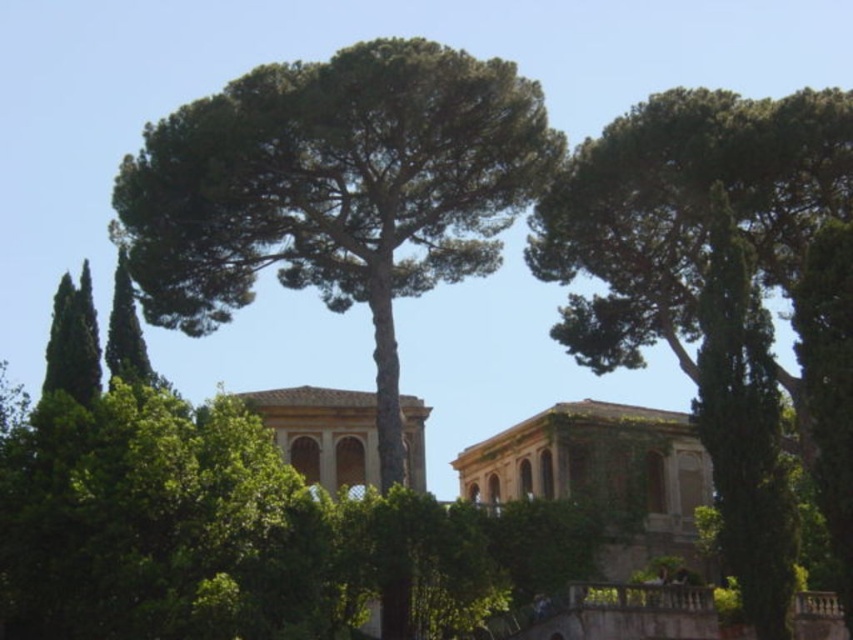
Question: Can you confirm if green leafy tree at center is positioned to the left of green leafy tree at upper center?

Choices:
 (A) no
 (B) yes

Answer: (B)

Question: Which point appears closest to the camera in this image?

Choices:
 (A) (345, 141)
 (B) (364, 426)

Answer: (A)

Question: Which of these objects is positioned farthest from the green leafy tree at center?

Choices:
 (A) brown stone palace at center
 (B) stone/brick palace at center
 (C) green leafy tree at upper center

Answer: (A)

Question: Is green leafy tree at center behind green leafy tree at upper center?

Choices:
 (A) no
 (B) yes

Answer: (B)

Question: Does green leafy tree at upper center appear over stone/brick palace at center?

Choices:
 (A) no
 (B) yes

Answer: (B)

Question: Which of the following is the closest to the observer?

Choices:
 (A) green leafy tree at center
 (B) brown stone palace at center

Answer: (A)